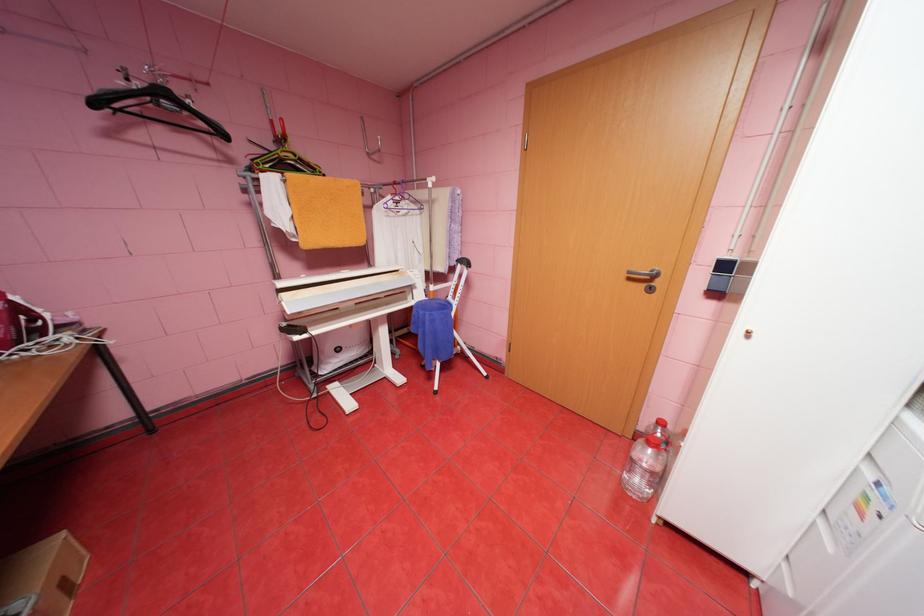
Where would you lift the cardboard box? Please return your answer as a coordinate pair (x, y).

(43, 577)